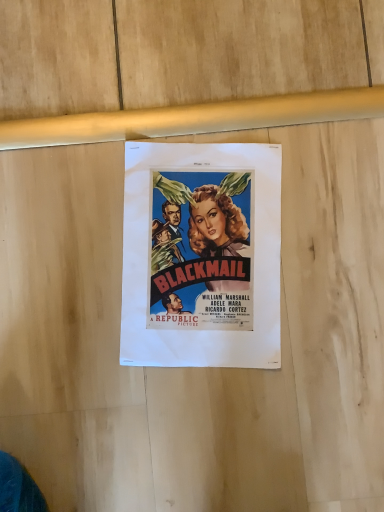
Where is `vivid paper poster at center`? The height and width of the screenshot is (512, 384). vivid paper poster at center is located at coordinates (201, 255).

Image resolution: width=384 pixels, height=512 pixels. What do you see at coordinates (201, 255) in the screenshot?
I see `vivid paper poster at center` at bounding box center [201, 255].

At what (x,y) coordinates should I click in order to perform the action: click on vivid paper poster at center. Please return your answer as a coordinate pair (x, y). Looking at the image, I should click on (201, 255).